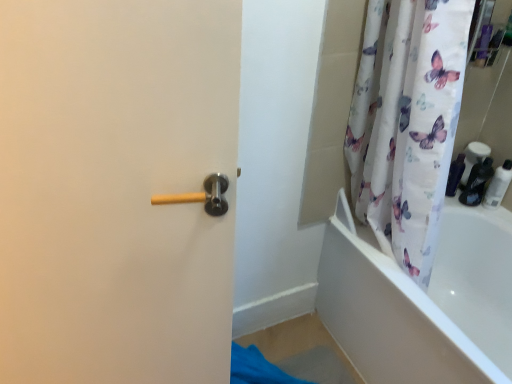
Question: Is matte black bottle at right, which appears as the 1th toiletry when viewed from the left, spatially inside white glossy bottle at right, placed as the 3th toiletry when sorted from left to right, or outside of it?

Choices:
 (A) outside
 (B) inside

Answer: (A)

Question: Is point (458, 175) positioned closer to the camera than point (495, 193)?

Choices:
 (A) farther
 (B) closer

Answer: (A)

Question: Which is nearer to the matte black bottle at right, the 3th toiletry when ordered from right to left?

Choices:
 (A) matte black toiletries at right, the second toiletry viewed from the left
 (B) white glossy bottle at right, placed as the 3th toiletry when sorted from left to right

Answer: (A)

Question: Which object is positioned closest to the white glossy bottle at right, placed as the 3th toiletry when sorted from left to right?

Choices:
 (A) matte black toiletries at right, which is counted as the second toiletry, starting from the right
 (B) matte black bottle at right, which appears as the 1th toiletry when viewed from the left

Answer: (A)